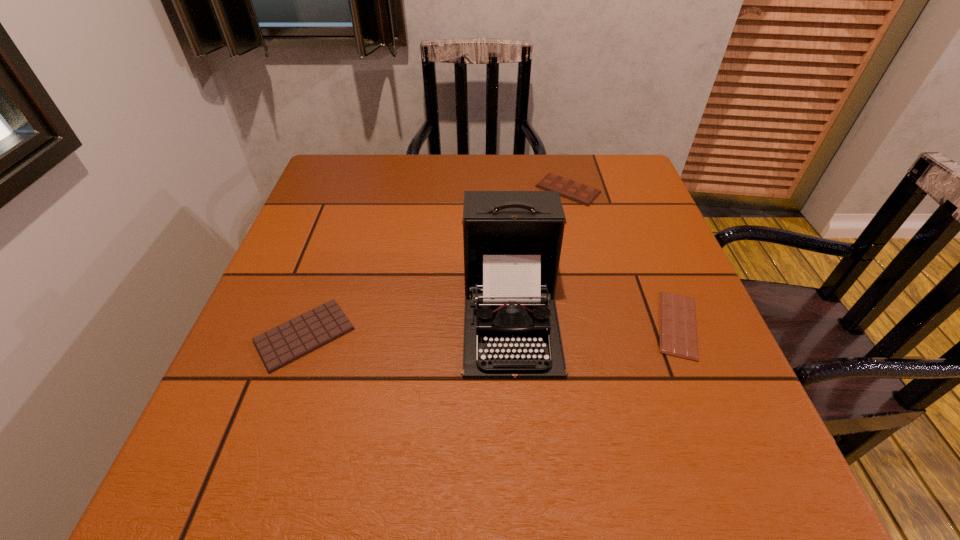
In order to click on the tallest object in this screenshot , I will do `click(512, 240)`.

You are a GUI agent. You are given a task and a screenshot of the screen. Output one action in this format:
    pyautogui.click(x=<x>, y=<y>)
    Task: Click on the second chocolate bar from left to right
    The height and width of the screenshot is (540, 960).
    Given the screenshot: What is the action you would take?
    pyautogui.click(x=572, y=190)

Where is `the second tallest object`? The image size is (960, 540). the second tallest object is located at coordinates (572, 190).

Where is `the second shortest chocolate bar`? the second shortest chocolate bar is located at coordinates (282, 345).

You are a GUI agent. You are given a task and a screenshot of the screen. Output one action in this format:
    pyautogui.click(x=<x>, y=<y>)
    Task: Click on the second shortest object
    Image resolution: width=960 pixels, height=540 pixels.
    Given the screenshot: What is the action you would take?
    pyautogui.click(x=282, y=345)

This screenshot has width=960, height=540. I want to click on the shortest object, so click(678, 329).

What are the coordinates of `the rightmost object` in the screenshot? It's located at (678, 329).

Find the location of a particular element. This screenshot has height=540, width=960. vacant space located 0.140m inside the open case of the tallest object is located at coordinates (520, 461).

This screenshot has height=540, width=960. I want to click on free space located on the left of the second chocolate bar from left to right, so click(x=388, y=190).

In order to click on vacant region located 0.290m on the right of the third tallest object in this screenshot , I will do `click(508, 335)`.